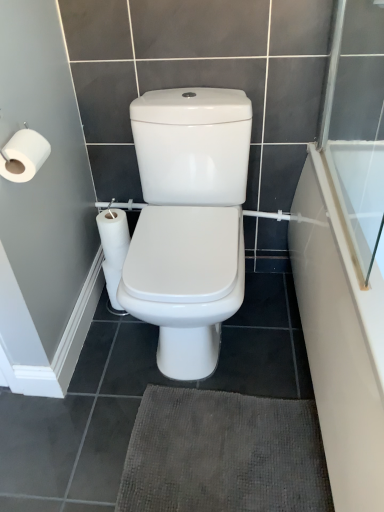
Identify the location of dark gray textured bath mat at lower center. The image size is (384, 512). (223, 454).

Where is `white matte toilet paper at left`? Image resolution: width=384 pixels, height=512 pixels. white matte toilet paper at left is located at coordinates [x=23, y=155].

Describe the element at coordinates (356, 126) in the screenshot. This screenshot has height=512, width=384. I see `transparent glass screen door at upper right` at that location.

Locate an element on the screen. transparent glass screen door at upper right is located at coordinates (356, 126).

The height and width of the screenshot is (512, 384). I want to click on white glossy bathtub at right, so click(x=340, y=340).

Could white matte toilet paper at left be considered to be inside transparent glass screen door at upper right?

No, white matte toilet paper at left is located outside of transparent glass screen door at upper right.

Is transparent glass screen door at upper right not close to white matte toilet paper at left?

Yes.

From a real-world perspective, which is physically below, transparent glass screen door at upper right or white matte toilet paper at left?

white matte toilet paper at left.

Which of these two, transparent glass screen door at upper right or white matte toilet paper at left, is smaller?

Smaller between the two is white matte toilet paper at left.

Relative to transparent glass screen door at upper right, is white glossy bathtub at right in front or behind?

Visually, white glossy bathtub at right is located in front of transparent glass screen door at upper right.

From the image's perspective, which one is positioned higher, white glossy bathtub at right or transparent glass screen door at upper right?

transparent glass screen door at upper right.

Does white glossy bathtub at right touch transparent glass screen door at upper right?

No, white glossy bathtub at right is not in contact with transparent glass screen door at upper right.

Is dark gray textured bath mat at lower center taller than transparent glass screen door at upper right?

No.

Can you confirm if dark gray textured bath mat at lower center is thinner than transparent glass screen door at upper right?

In fact, dark gray textured bath mat at lower center might be wider than transparent glass screen door at upper right.

From the image's perspective, is dark gray textured bath mat at lower center positioned above or below transparent glass screen door at upper right?

Clearly, from the image's perspective, dark gray textured bath mat at lower center is below transparent glass screen door at upper right.

Is white matte toilet paper at left wider or thinner than dark gray textured bath mat at lower center?

white matte toilet paper at left is thinner than dark gray textured bath mat at lower center.

Looking at the image, does white matte toilet paper at left seem bigger or smaller compared to dark gray textured bath mat at lower center?

Considering their sizes, white matte toilet paper at left takes up less space than dark gray textured bath mat at lower center.

In the image, is white matte toilet paper at left on the left side or the right side of dark gray textured bath mat at lower center?

Based on their positions, white matte toilet paper at left is located to the left of dark gray textured bath mat at lower center.

From the image's perspective, is white matte toilet paper at left above or below dark gray textured bath mat at lower center?

Based on their image positions, white matte toilet paper at left is located above dark gray textured bath mat at lower center.

Consider the image. In the image, is white matte toilet paper at left positioned in front of or behind transparent glass screen door at upper right?

In the image, white matte toilet paper at left appears behind transparent glass screen door at upper right.

Is white matte toilet paper at left bigger than transparent glass screen door at upper right?

Actually, white matte toilet paper at left might be smaller than transparent glass screen door at upper right.

In order to click on screen door on the right of white matte toilet paper at left in this screenshot , I will do `click(356, 126)`.

Considering the positions of point (10, 163) and point (358, 143), is point (10, 163) closer or farther from the camera than point (358, 143)?

Clearly, point (10, 163) is closer to the camera than point (358, 143).

From the image's perspective, who appears lower, white glossy bathtub at right or dark gray textured bath mat at lower center?

dark gray textured bath mat at lower center, from the image's perspective.

How different are the orientations of white glossy bathtub at right and dark gray textured bath mat at lower center in degrees?

The facing directions of white glossy bathtub at right and dark gray textured bath mat at lower center are 3.73 degrees apart.

In the scene shown: Is white glossy bathtub at right wider than dark gray textured bath mat at lower center?

Incorrect, the width of white glossy bathtub at right does not surpass that of dark gray textured bath mat at lower center.

How far apart are white glossy bathtub at right and dark gray textured bath mat at lower center?

A distance of 13.83 inches exists between white glossy bathtub at right and dark gray textured bath mat at lower center.

From a real-world perspective, which is physically below, transparent glass screen door at upper right or white glossy bathtub at right?

From a 3D spatial view, white glossy bathtub at right is below.

Is there a large distance between transparent glass screen door at upper right and white glossy bathtub at right?

No, transparent glass screen door at upper right is in close proximity to white glossy bathtub at right.

Do you think transparent glass screen door at upper right is within white glossy bathtub at right, or outside of it?

The correct answer is: outside.

Does transparent glass screen door at upper right have a lesser width compared to white glossy bathtub at right?

Yes, transparent glass screen door at upper right is thinner than white glossy bathtub at right.

This screenshot has width=384, height=512. Identify the location of screen door in front of the white matte toilet paper at left. (356, 126).

I want to click on screen door above the white glossy bathtub at right (from the image's perspective), so click(356, 126).

Looking at the image, which one is located closer to white glossy bathtub at right, transparent glass screen door at upper right or dark gray textured bath mat at lower center?

dark gray textured bath mat at lower center is closer to white glossy bathtub at right.

Based on their spatial positions, is white matte toilet paper at left or transparent glass screen door at upper right closer to dark gray textured bath mat at lower center?

Among the two, white matte toilet paper at left is located nearer to dark gray textured bath mat at lower center.

Based on their spatial positions, is white matte toilet paper at left or transparent glass screen door at upper right closer to white glossy bathtub at right?

transparent glass screen door at upper right.

Looking at the image, which one is located closer to white matte toilet paper at left, transparent glass screen door at upper right or dark gray textured bath mat at lower center?

Among the two, dark gray textured bath mat at lower center is located nearer to white matte toilet paper at left.

Which object lies nearer to the anchor point transparent glass screen door at upper right, dark gray textured bath mat at lower center or white matte toilet paper at left?

dark gray textured bath mat at lower center is positioned closer to the anchor transparent glass screen door at upper right.

When comparing their distances from dark gray textured bath mat at lower center, does white glossy bathtub at right or white matte toilet paper at left seem further?

white matte toilet paper at left.

Looking at the image, which one is located further to dark gray textured bath mat at lower center, transparent glass screen door at upper right or white matte toilet paper at left?

transparent glass screen door at upper right is positioned further to the anchor dark gray textured bath mat at lower center.

Which object lies nearer to the anchor point transparent glass screen door at upper right, white glossy bathtub at right or white matte toilet paper at left?

white glossy bathtub at right is closer to transparent glass screen door at upper right.

I want to click on toilet paper between transparent glass screen door at upper right and dark gray textured bath mat at lower center from top to bottom, so click(x=23, y=155).

Identify the location of screen door between white matte toilet paper at left and white glossy bathtub at right in the horizontal direction. This screenshot has width=384, height=512. (356, 126).

Where is `bath mat between white matte toilet paper at left and white glossy bathtub at right in the horizontal direction`? This screenshot has height=512, width=384. bath mat between white matte toilet paper at left and white glossy bathtub at right in the horizontal direction is located at coordinates (223, 454).

Where is `bath between transparent glass screen door at upper right and dark gray textured bath mat at lower center in the vertical direction`? This screenshot has height=512, width=384. bath between transparent glass screen door at upper right and dark gray textured bath mat at lower center in the vertical direction is located at coordinates (340, 340).